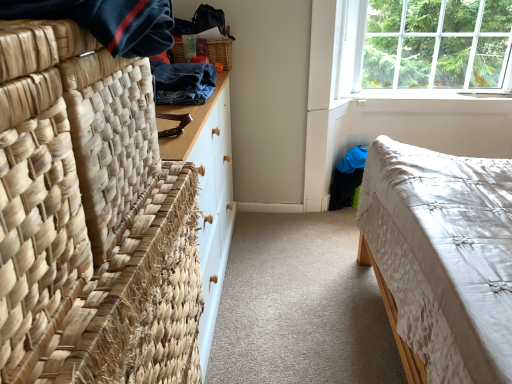
Question: From the image's perspective, is denim fabric at upper left, acting as the first clothing starting from the back, below woven wood picnic basket at upper center?

Choices:
 (A) no
 (B) yes

Answer: (B)

Question: From the image's perspective, is denim fabric at upper left, the second clothing from the front, over woven wood picnic basket at upper center?

Choices:
 (A) no
 (B) yes

Answer: (A)

Question: Is denim fabric at upper left, acting as the first clothing starting from the back, to the right of woven wood picnic basket at upper center from the viewer's perspective?

Choices:
 (A) no
 (B) yes

Answer: (A)

Question: Is denim fabric at upper left, the second clothing from the front, looking in the opposite direction of woven wood picnic basket at upper center?

Choices:
 (A) no
 (B) yes

Answer: (A)

Question: Does denim fabric at upper left, acting as the first clothing starting from the back, have a greater width compared to woven wood picnic basket at upper center?

Choices:
 (A) no
 (B) yes

Answer: (B)

Question: Is clear glass window at upper right wider or thinner than dark blue woven fabric at upper left, which is the 1th clothing from front to back?

Choices:
 (A) wide
 (B) thin

Answer: (B)

Question: From a real-world perspective, relative to dark blue woven fabric at upper left, the second clothing viewed from the back, is clear glass window at upper right vertically above or below?

Choices:
 (A) below
 (B) above

Answer: (A)

Question: Considering the positions of point (395, 29) and point (46, 8), is point (395, 29) closer or farther from the camera than point (46, 8)?

Choices:
 (A) farther
 (B) closer

Answer: (A)

Question: Looking at the image, does clear glass window at upper right seem bigger or smaller compared to dark blue woven fabric at upper left, the second clothing viewed from the back?

Choices:
 (A) big
 (B) small

Answer: (A)

Question: Looking at the image, does white quilted fabric bed at lower right seem bigger or smaller compared to natural woven mat at left?

Choices:
 (A) big
 (B) small

Answer: (A)

Question: Considering their positions, is white quilted fabric bed at lower right located in front of or behind natural woven mat at left?

Choices:
 (A) behind
 (B) front

Answer: (A)

Question: Is white quilted fabric bed at lower right taller or shorter than natural woven mat at left?

Choices:
 (A) tall
 (B) short

Answer: (A)

Question: Is white quilted fabric bed at lower right situated inside natural woven mat at left or outside?

Choices:
 (A) inside
 (B) outside

Answer: (B)

Question: In terms of height, does denim fabric at upper left, acting as the first clothing starting from the back, look taller or shorter compared to natural woven mat at left?

Choices:
 (A) tall
 (B) short

Answer: (B)

Question: Is denim fabric at upper left, acting as the first clothing starting from the back, wider or thinner than natural woven mat at left?

Choices:
 (A) thin
 (B) wide

Answer: (A)